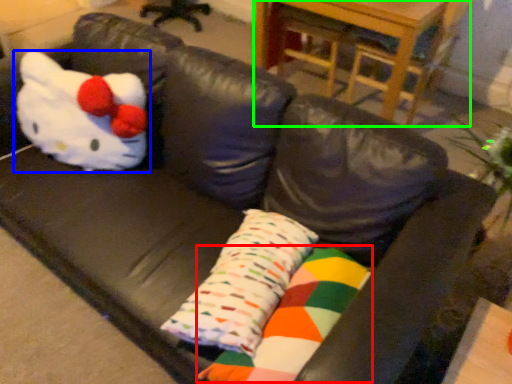
Question: Which object is the farthest from material (highlighted by a red box)? Choose among these: toy (highlighted by a blue box) or table (highlighted by a green box).

Choices:
 (A) toy
 (B) table

Answer: (B)